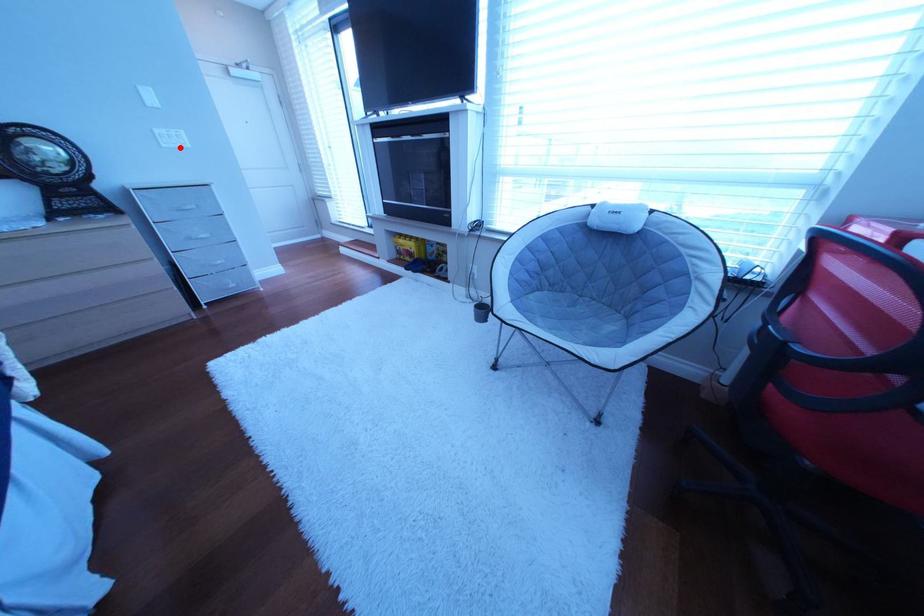
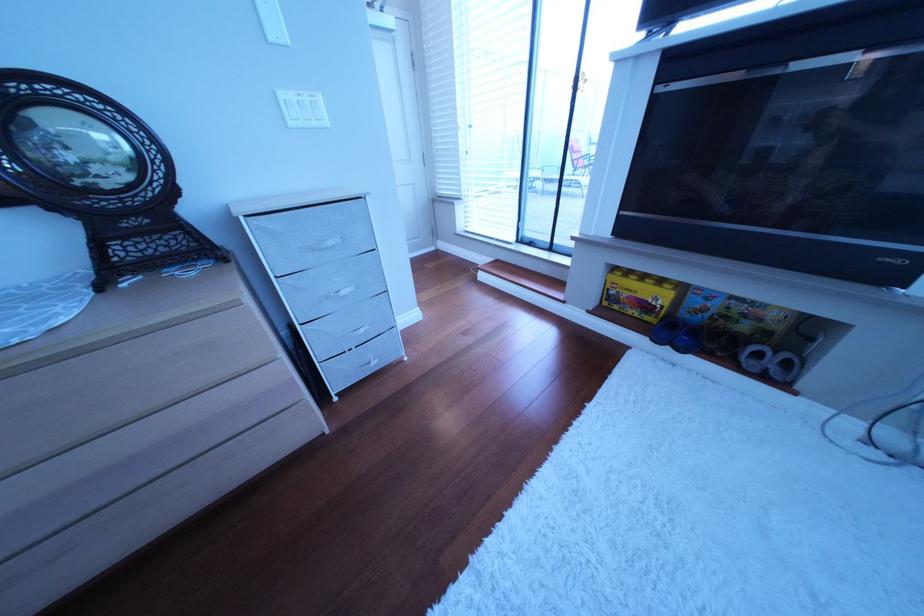
In the second image, find the point that corresponds to the highlighted location in the first image.

(307, 126)